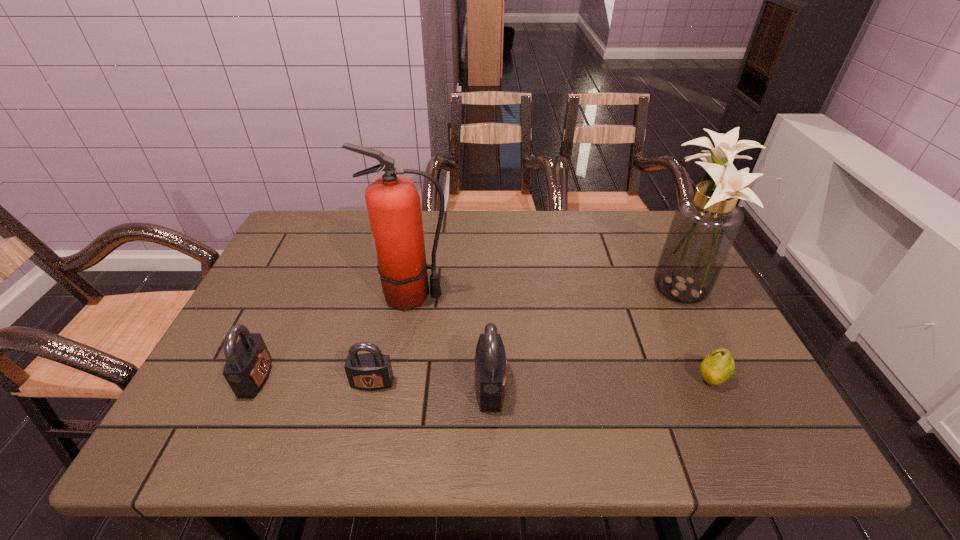
Please point a spot to add another padlock on the right. Please provide its 2D coordinates. Your answer should be formatted as a tuple, i.e. [(x, y)], where the tuple contains the x and y coordinates of a point satisfying the conditions above.

[(611, 391)]